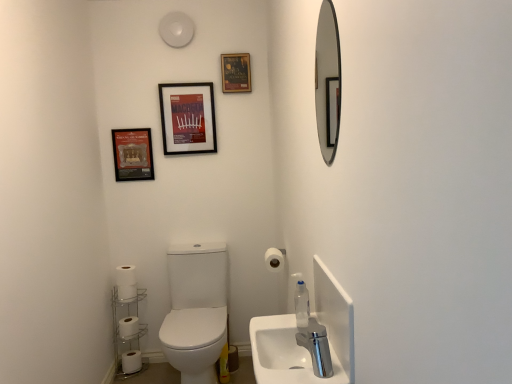
Question: Is silver/metallic toilet paper holder at lower left at the right side of silver-framed mirror at upper right?

Choices:
 (A) yes
 (B) no

Answer: (B)

Question: Is silver/metallic toilet paper holder at lower left shorter than silver-framed mirror at upper right?

Choices:
 (A) no
 (B) yes

Answer: (A)

Question: Is silver/metallic toilet paper holder at lower left at the left side of silver-framed mirror at upper right?

Choices:
 (A) no
 (B) yes

Answer: (B)

Question: Are silver/metallic toilet paper holder at lower left and silver-framed mirror at upper right located far from each other?

Choices:
 (A) yes
 (B) no

Answer: (A)

Question: Are silver/metallic toilet paper holder at lower left and silver-framed mirror at upper right making contact?

Choices:
 (A) no
 (B) yes

Answer: (A)

Question: Is silver/metallic toilet paper holder at lower left outside silver-framed mirror at upper right?

Choices:
 (A) yes
 (B) no

Answer: (A)

Question: Does matte paper poster at upper center, the 2th decorative picture when ordered from left to right, lie in front of white matte toilet paper at lower left, the third toilet paper from the top?

Choices:
 (A) no
 (B) yes

Answer: (A)

Question: Could you tell me if matte paper poster at upper center, the 2th decorative picture when ordered from left to right, is facing white matte toilet paper at lower left, which is counted as the 1th toilet paper, starting from the left?

Choices:
 (A) yes
 (B) no

Answer: (B)

Question: Considering the relative sizes of matte paper poster at upper center, which appears as the second decorative picture when ordered from the bottom, and white matte toilet paper at lower left, which is counted as the 1th toilet paper, starting from the left, in the image provided, is matte paper poster at upper center, which appears as the second decorative picture when ordered from the bottom, taller than white matte toilet paper at lower left, which is counted as the 1th toilet paper, starting from the left,?

Choices:
 (A) no
 (B) yes

Answer: (B)

Question: Is matte paper poster at upper center, which appears as the second decorative picture when ordered from the bottom, behind white matte toilet paper at lower left, which is the third toilet paper in front-to-back order?

Choices:
 (A) no
 (B) yes

Answer: (B)

Question: Is matte paper poster at upper center, the first decorative picture positioned from the right, touching white matte toilet paper at lower left, the third toilet paper from the top?

Choices:
 (A) no
 (B) yes

Answer: (A)

Question: Is matte paper poster at upper center, which appears as the second decorative picture when ordered from the bottom, at the left side of white matte toilet paper at lower left, which is the 2th toilet paper in back-to-front order?

Choices:
 (A) no
 (B) yes

Answer: (A)

Question: Is matte paper poster at upper center, the 2th decorative picture when ordered from left to right, surrounded by matte black frame at upper left, which appears as the 2th decorative picture when viewed from the top?

Choices:
 (A) no
 (B) yes

Answer: (A)